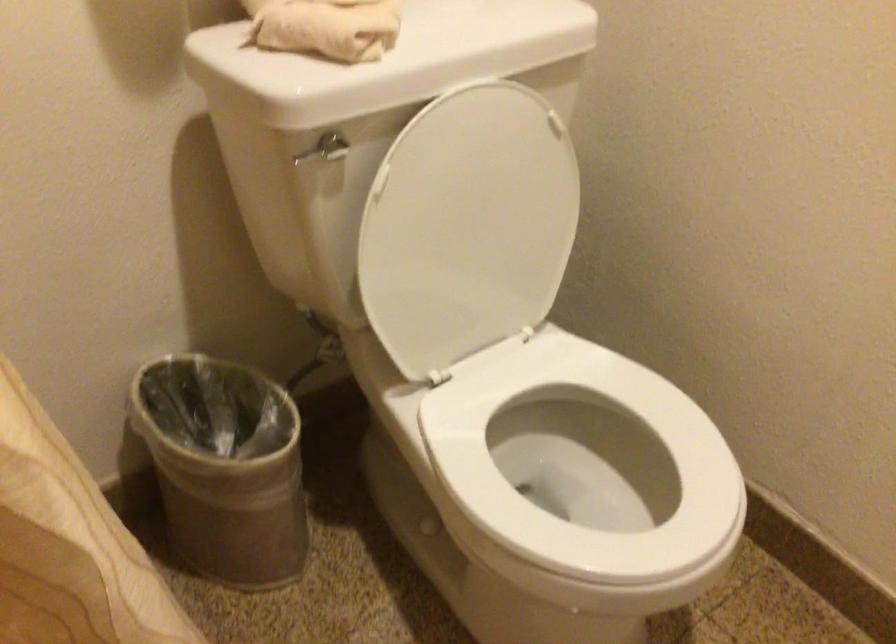
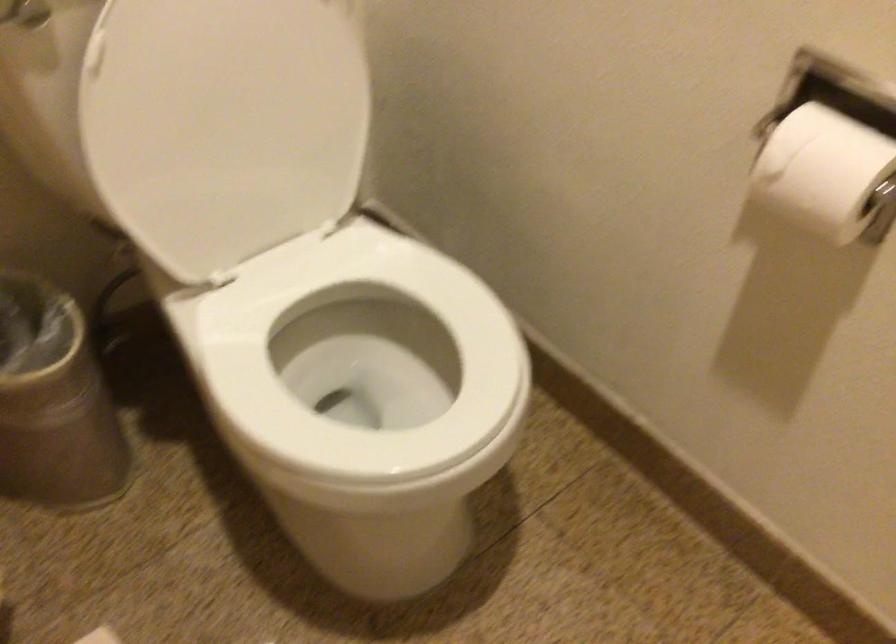
Locate, in the second image, the point that corresponds to [264,491] in the first image.

(54, 402)